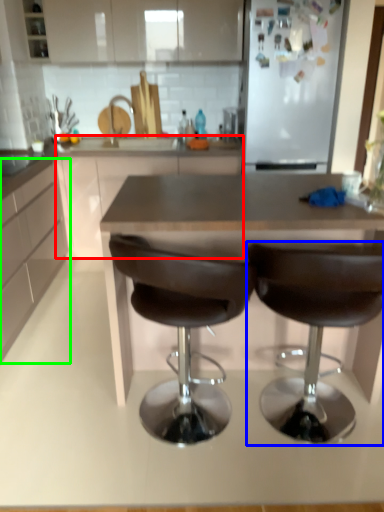
Question: Which object is the closest to the counter (highlighted by a red box)? Choose among these: chair (highlighted by a blue box) or cabinetry (highlighted by a green box).

Choices:
 (A) chair
 (B) cabinetry

Answer: (B)